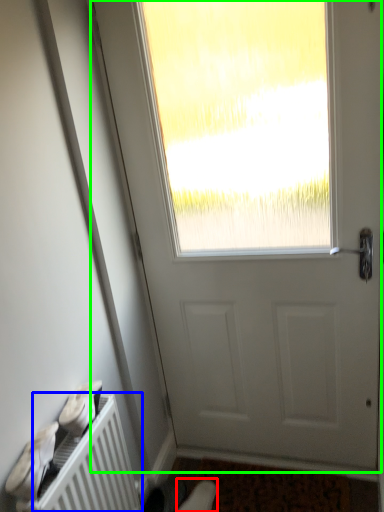
Question: Which object is positioned farthest from shoe (highlighted by a red box)? Select from radiator (highlighted by a blue box) and door (highlighted by a green box).

Choices:
 (A) radiator
 (B) door

Answer: (B)